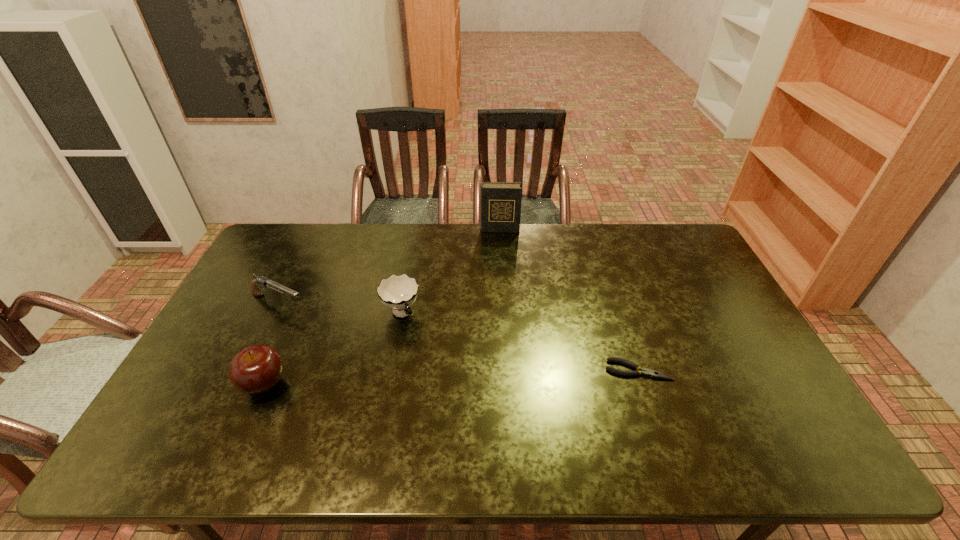
Where is `vacant space on the desktop that is between the second tallest object and the shortest object and is positioned on the side of the third object from left to right with the handle`? This screenshot has height=540, width=960. vacant space on the desktop that is between the second tallest object and the shortest object and is positioned on the side of the third object from left to right with the handle is located at coordinates (442, 377).

The height and width of the screenshot is (540, 960). I want to click on vacant space on the desktop that is between the second tallest object and the rightmost object and is positioned aiming along the barrel of the gun, so click(x=434, y=377).

The height and width of the screenshot is (540, 960). Find the location of `free spot on the desktop that is between the apple and the rightmost object and is positioned on the front cover of the tallest object`. free spot on the desktop that is between the apple and the rightmost object and is positioned on the front cover of the tallest object is located at coordinates (499, 375).